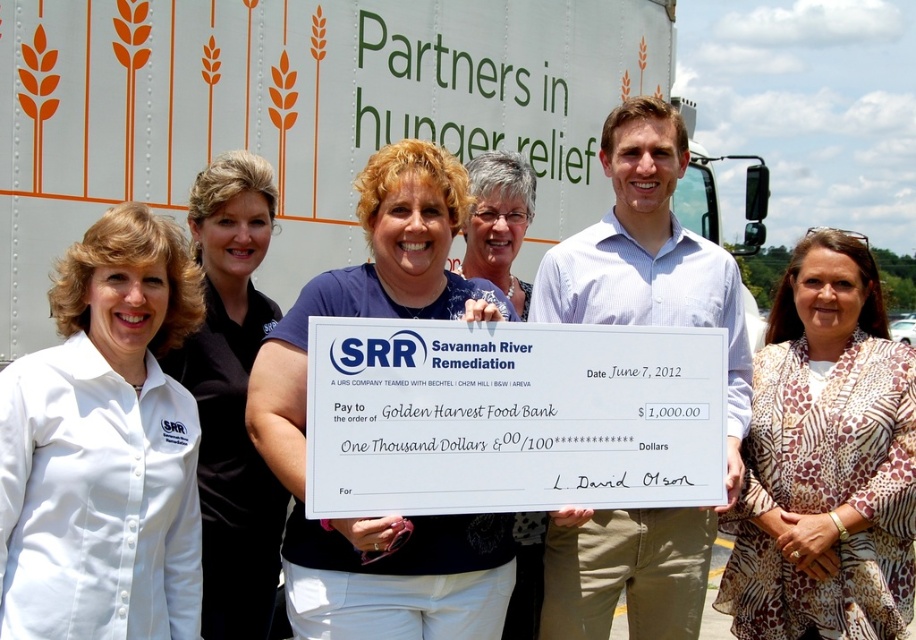
Question: Among these objects, which one is farthest from the camera?

Choices:
 (A) printed fabric blouse at center
 (B) white matte trailer truck at upper center

Answer: (B)

Question: Is white shirt at center bigger than printed fabric blouse at center?

Choices:
 (A) no
 (B) yes

Answer: (A)

Question: Estimate the real-world distances between objects in this image. Which object is closer to the white shirt at center?

Choices:
 (A) printed fabric blouse at center
 (B) white matte trailer truck at upper center

Answer: (B)

Question: Which point appears farthest from the camera in this image?

Choices:
 (A) (3, 292)
 (B) (844, 493)

Answer: (B)

Question: Observing the image, what is the correct spatial positioning of white matte trailer truck at upper center in reference to white shirt at center?

Choices:
 (A) left
 (B) right

Answer: (B)

Question: Observing the image, what is the correct spatial positioning of white matte trailer truck at upper center in reference to white shirt at center?

Choices:
 (A) left
 (B) right

Answer: (B)